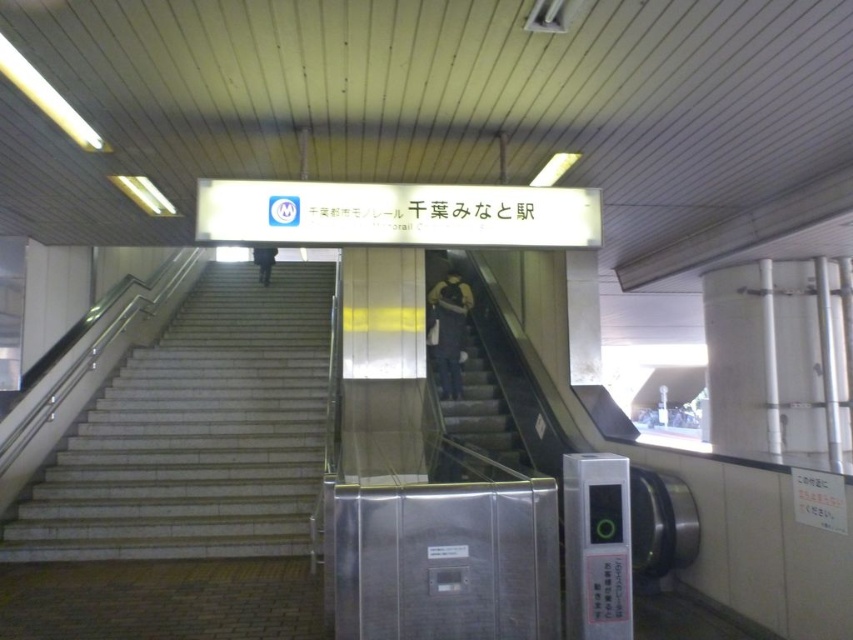
Who is lower down, gray concrete stairs at center or dark blue jeans at upper center?

Positioned lower is gray concrete stairs at center.

Measure the distance between point (508, 445) and camera.

They are 7.24 meters apart.

Who is more distant from viewer, (467,426) or (262,250)?

Point (262,250)

Identify the location of gray concrete stairs at center. The width and height of the screenshot is (853, 640). (483, 410).

Is white marble stairs at center closer to the viewer compared to dark blue jeans at upper center?

Yes, it is.

Is point (51, 504) positioned after point (263, 246)?

Yes, it is behind point (263, 246).

Locate an element on the screen. The height and width of the screenshot is (640, 853). white marble stairs at center is located at coordinates (196, 433).

Does gray concrete stairs at center have a smaller size compared to dark blue jeans at center?

No, gray concrete stairs at center is not smaller than dark blue jeans at center.

Is gray concrete stairs at center taller than dark blue jeans at center?

No.

Identify the location of gray concrete stairs at center. This screenshot has height=640, width=853. (483, 410).